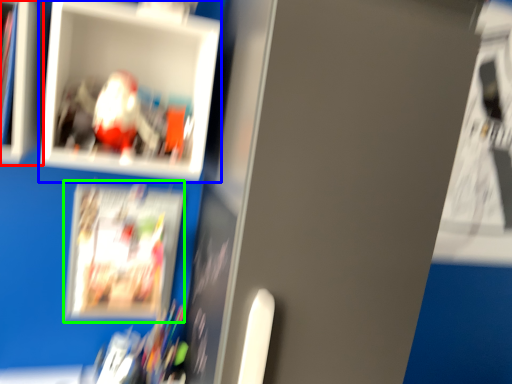
Question: Which object is positioned farthest from cabinet (highlighted by a red box)? Select from picture frame (highlighted by a blue box) and magazine (highlighted by a green box).

Choices:
 (A) picture frame
 (B) magazine

Answer: (B)